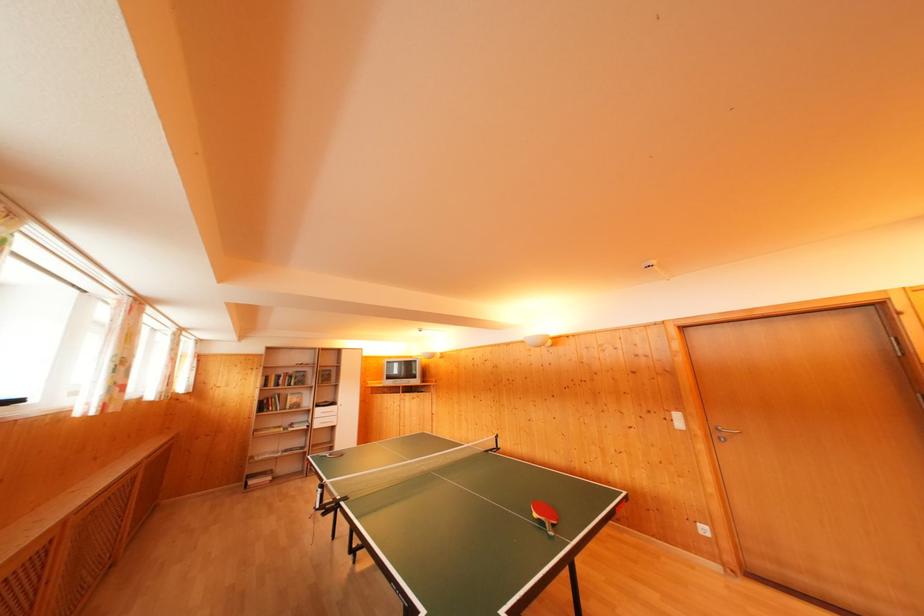
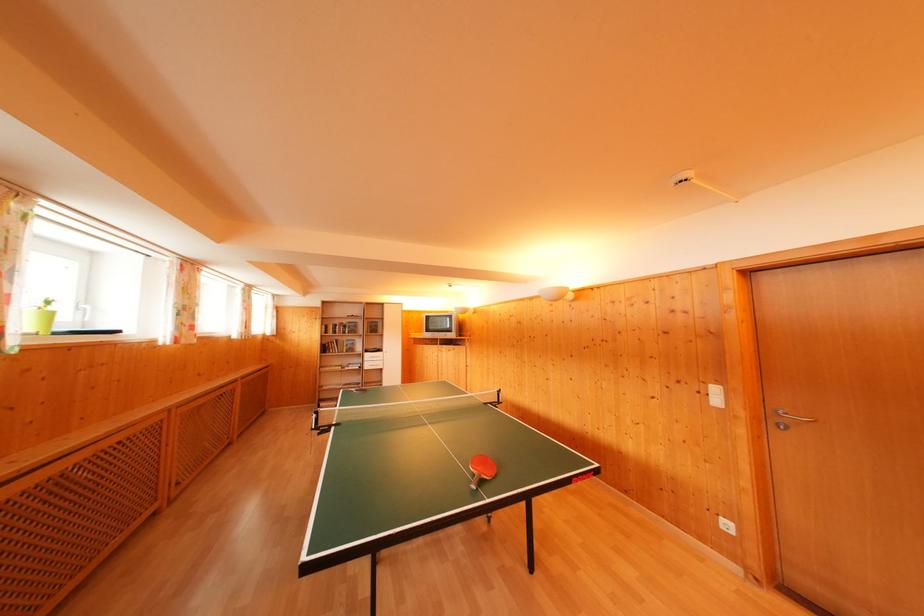
Locate, in the second image, the point that corresponds to point 265,395 in the first image.

(326, 342)